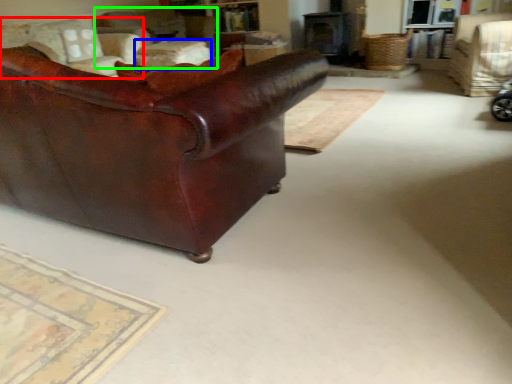
Question: Based on their relative distances, which object is nearer to chair (highlighted by a red box)? Choose from table (highlighted by a blue box) and chair (highlighted by a green box).

Choices:
 (A) table
 (B) chair

Answer: (B)